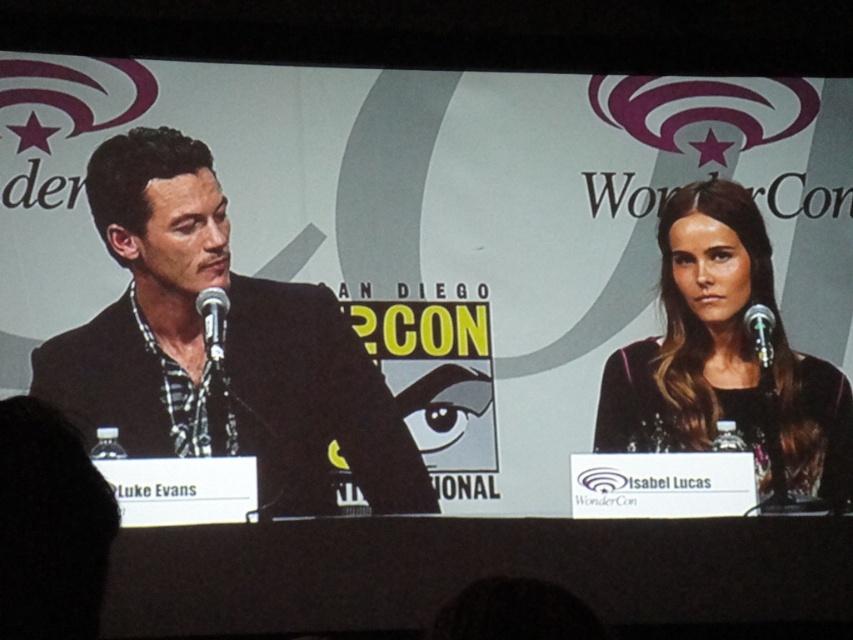
Does black textured suit at left come in front of silver metallic microphone at right?

Yes, it is.

Which of these two, black textured suit at left or silver metallic microphone at right, stands taller?

With more height is black textured suit at left.

Between point (189, 449) and point (766, 358), which one is positioned behind?

Positioned behind is point (766, 358).

Identify the location of black textured suit at left. Image resolution: width=853 pixels, height=640 pixels. (224, 346).

Is point (115, 202) positioned before point (222, 307)?

No.

Between point (155, 435) and point (215, 308), which one is positioned in front?

Positioned in front is point (155, 435).

The width and height of the screenshot is (853, 640). Identify the location of black textured suit at left. (224, 346).

Where is `black textured suit at left`? The image size is (853, 640). black textured suit at left is located at coordinates (224, 346).

Measure the distance between black sequined dress at right and silver metallic microphone at right.

The distance of black sequined dress at right from silver metallic microphone at right is 5.90 meters.

Find the location of a particular element. The height and width of the screenshot is (640, 853). black sequined dress at right is located at coordinates (724, 355).